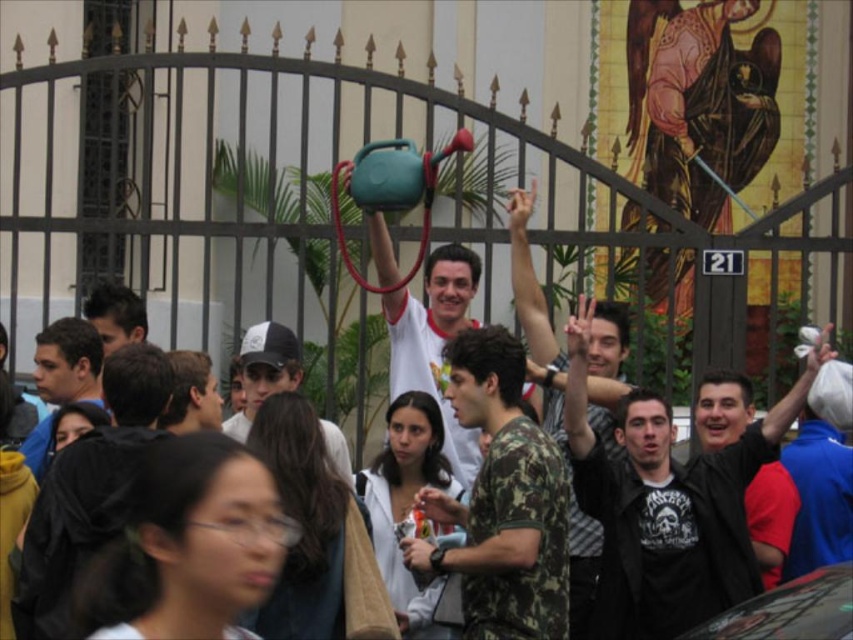
Question: Does camouflage fabric shirt at center appear on the right side of camouflage-patterned shirt at center?

Choices:
 (A) no
 (B) yes

Answer: (B)

Question: Which point appears closest to the camera in this image?

Choices:
 (A) (294, 356)
 (B) (699, 513)
 (C) (177, 413)
 (D) (473, 413)

Answer: (C)

Question: Does matte green water jug at center have a lesser width compared to matte black jacket at center?

Choices:
 (A) no
 (B) yes

Answer: (A)

Question: Which point appears closest to the camera in this image?

Choices:
 (A) (131, 390)
 (B) (392, 360)

Answer: (A)

Question: Is camouflage fabric shirt at center to the left of camouflage uniform at center from the viewer's perspective?

Choices:
 (A) no
 (B) yes

Answer: (A)

Question: Among these objects, which one is farthest from the camera?

Choices:
 (A) matte black jacket at center
 (B) matte green water jug at center
 (C) dark brown hair at center
 (D) camouflage fabric shirt at center

Answer: (C)